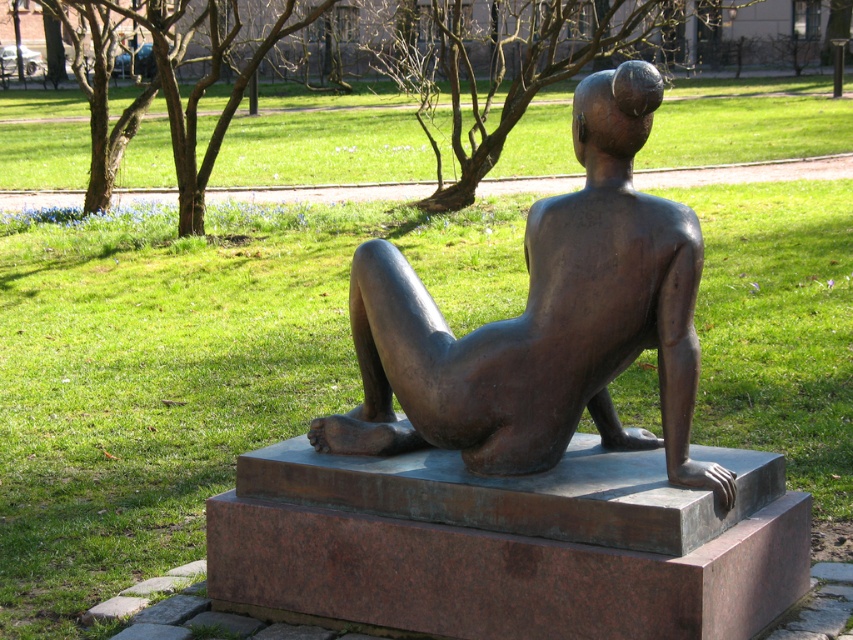
Question: Is bronze statue at center smaller than green grass at upper center?

Choices:
 (A) no
 (B) yes

Answer: (B)

Question: Which of the following is the farthest from the observer?

Choices:
 (A) (624, 189)
 (B) (146, 138)

Answer: (B)

Question: In this image, where is bronze statue at center located relative to green grass at upper center?

Choices:
 (A) left
 (B) right

Answer: (B)

Question: Is bronze statue at center above green grass at upper center?

Choices:
 (A) yes
 (B) no

Answer: (B)

Question: Which object appears farthest from the camera in this image?

Choices:
 (A) bronze statue at center
 (B) green grass at upper center

Answer: (B)